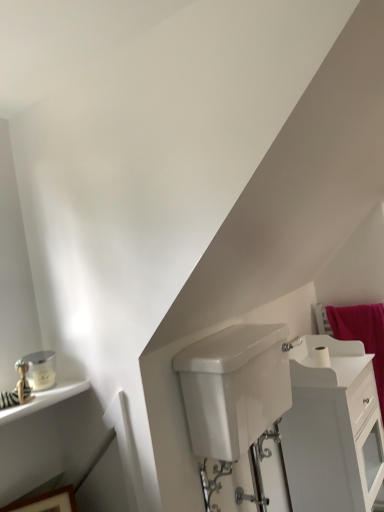
The width and height of the screenshot is (384, 512). I want to click on white glossy tank at lower center, so click(234, 388).

What is the approximate width of pink fabric bath towel at right?

→ It is 7.90 inches.

Find the location of a particular element. white glossy tank at lower center is located at coordinates (234, 388).

Is white glossy tank at lower center facing towards white matte toilet paper at upper right?

No, white glossy tank at lower center does not turn towards white matte toilet paper at upper right.

Does point (282, 395) come in front of point (327, 366)?

That is True.

Is white glossy tank at lower center taller than white matte toilet paper at upper right?

Correct, white glossy tank at lower center is much taller as white matte toilet paper at upper right.

Measure the distance between white glossy tank at lower center and white matte toilet paper at upper right.

white glossy tank at lower center and white matte toilet paper at upper right are 18.88 inches apart.

Is white glossy tank at lower center next to wooden picture frame at lower left and touching it?

There is a gap between white glossy tank at lower center and wooden picture frame at lower left.

Between white glossy tank at lower center and wooden picture frame at lower left, which one has smaller width?

wooden picture frame at lower left is thinner.

Considering the positions of point (273, 331) and point (55, 490), is point (273, 331) closer or farther from the camera than point (55, 490)?

Point (273, 331) appears to be farther away from the viewer than point (55, 490).

From a real-world perspective, which object stands above the other?

white glossy tank at lower center, from a real-world perspective.

Is white glossy cabinet at lower right not within white glossy tank at lower center?

Yes.

What's the angular difference between white glossy cabinet at lower right and white glossy tank at lower center's facing directions?

The angle between the facing direction of white glossy cabinet at lower right and the facing direction of white glossy tank at lower center is 1.55 degrees.

Which object is thinner, white glossy cabinet at lower right or white glossy tank at lower center?

Thinner between the two is white glossy tank at lower center.

From the image's perspective, is white matte toilet paper at upper right below wooden picture frame at lower left?

Incorrect, from the image's perspective, white matte toilet paper at upper right is higher than wooden picture frame at lower left.

How much distance is there between white matte toilet paper at upper right and wooden picture frame at lower left?

white matte toilet paper at upper right and wooden picture frame at lower left are 3.55 feet apart.

Is white matte toilet paper at upper right facing away from wooden picture frame at lower left?

white matte toilet paper at upper right does not have its back to wooden picture frame at lower left.

Is point (314, 355) more distant than point (65, 511)?

Yes, point (314, 355) is farther from viewer.

Could you tell me if white glossy tank at lower center is turned towards pink fabric bath towel at right?

No, white glossy tank at lower center is not oriented towards pink fabric bath towel at right.

From the image's perspective, is white glossy tank at lower center over pink fabric bath towel at right?

Yes.

Is white glossy tank at lower center not within pink fabric bath towel at right?

Yes, white glossy tank at lower center is located beyond the bounds of pink fabric bath towel at right.

Can you tell me how much white glossy tank at lower center and pink fabric bath towel at right differ in facing direction?

The angular difference between white glossy tank at lower center and pink fabric bath towel at right is 92.1 degrees.

Which of these two, wooden picture frame at lower left or white matte toilet paper at upper right, stands taller?

wooden picture frame at lower left.

Considering the relative sizes of wooden picture frame at lower left and white matte toilet paper at upper right in the image provided, is wooden picture frame at lower left thinner than white matte toilet paper at upper right?

No.

From the image's perspective, is wooden picture frame at lower left located above white matte toilet paper at upper right?

Actually, wooden picture frame at lower left appears below white matte toilet paper at upper right in the image.

From a real-world perspective, is pink fabric bath towel at right below white glossy tank at lower center?

Yes.

Which is more to the left, pink fabric bath towel at right or white glossy tank at lower center?

From the viewer's perspective, white glossy tank at lower center appears more on the left side.

Where is `sink that appears in front of the pink fabric bath towel at right`? sink that appears in front of the pink fabric bath towel at right is located at coordinates (234, 388).

Does pink fabric bath towel at right turn towards white glossy tank at lower center?

Yes, pink fabric bath towel at right is facing white glossy tank at lower center.

Locate an element on the screen. The image size is (384, 512). toilet paper that appears below the white glossy tank at lower center (from the image's perspective) is located at coordinates (321, 357).

This screenshot has width=384, height=512. Identify the location of picture frame on the left of white glossy tank at lower center. point(46,502).

Estimate the real-world distances between objects in this image. Which object is closer to white glossy tank at lower center, white glossy cabinet at lower right or white matte toilet paper at upper right?

white glossy cabinet at lower right is positioned closer to the anchor white glossy tank at lower center.

Estimate the real-world distances between objects in this image. Which object is closer to white matte toilet paper at upper right, white glossy cabinet at lower right or pink fabric bath towel at right?

white glossy cabinet at lower right lies closer to white matte toilet paper at upper right than the other object.

Based on their spatial positions, is wooden picture frame at lower left or pink fabric bath towel at right closer to white matte toilet paper at upper right?

pink fabric bath towel at right is closer to white matte toilet paper at upper right.

From the image, which object appears to be nearer to white glossy cabinet at lower right, white matte toilet paper at upper right or pink fabric bath towel at right?

pink fabric bath towel at right lies closer to white glossy cabinet at lower right than the other object.

Considering their positions, is pink fabric bath towel at right positioned further to white matte toilet paper at upper right than wooden picture frame at lower left?

Based on the image, wooden picture frame at lower left appears to be further to white matte toilet paper at upper right.

From the image, which object appears to be farther from wooden picture frame at lower left, white matte toilet paper at upper right or white glossy tank at lower center?

white matte toilet paper at upper right is further to wooden picture frame at lower left.

When comparing their distances from white glossy cabinet at lower right, does white matte toilet paper at upper right or white glossy tank at lower center seem closer?

Among the two, white matte toilet paper at upper right is located nearer to white glossy cabinet at lower right.

Which object lies further to the anchor point wooden picture frame at lower left, pink fabric bath towel at right or white glossy tank at lower center?

pink fabric bath towel at right is further to wooden picture frame at lower left.

Where is `sink between wooden picture frame at lower left and pink fabric bath towel at right in the horizontal direction`? The width and height of the screenshot is (384, 512). sink between wooden picture frame at lower left and pink fabric bath towel at right in the horizontal direction is located at coordinates (234, 388).

In order to click on sink between wooden picture frame at lower left and white matte toilet paper at upper right in the horizontal direction in this screenshot , I will do `click(234, 388)`.

Where is `bathroom cabinet located between wooden picture frame at lower left and pink fabric bath towel at right in the left-right direction`? bathroom cabinet located between wooden picture frame at lower left and pink fabric bath towel at right in the left-right direction is located at coordinates (333, 429).

Where is `toilet paper between wooden picture frame at lower left and pink fabric bath towel at right from left to right`? This screenshot has width=384, height=512. toilet paper between wooden picture frame at lower left and pink fabric bath towel at right from left to right is located at coordinates (321, 357).